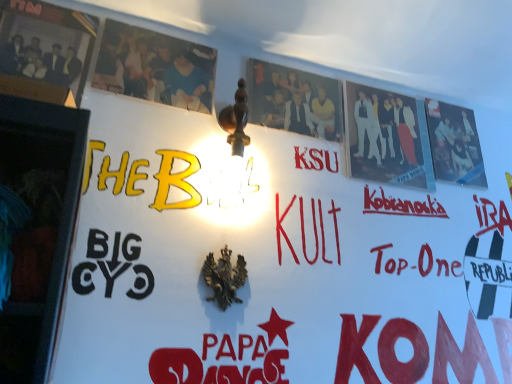
The width and height of the screenshot is (512, 384). In order to click on matte paper poster at center, which ranks as the third poster in right-to-left order in this screenshot , I will do `click(294, 100)`.

What do you see at coordinates (294, 100) in the screenshot? I see `matte paper poster at center, which ranks as the third poster in right-to-left order` at bounding box center [294, 100].

Measure the distance between matte paper poster at upper left, the fourth poster viewed from the right, and camera.

The distance of matte paper poster at upper left, the fourth poster viewed from the right, from camera is 3.76 feet.

What do you see at coordinates (454, 144) in the screenshot? I see `matte black poster at upper right, which ranks as the fifth poster in left-to-right order` at bounding box center [454, 144].

The image size is (512, 384). I want to click on silhouette paper poster at upper right, the 4th poster viewed from the left, so click(387, 138).

The image size is (512, 384). What do you see at coordinates (387, 138) in the screenshot?
I see `silhouette paper poster at upper right, which appears as the 2th poster when viewed from the right` at bounding box center [387, 138].

Where is `matte paper poster at center, which ranks as the third poster in right-to-left order`? matte paper poster at center, which ranks as the third poster in right-to-left order is located at coordinates (294, 100).

Is matte black poster at upper right, positioned as the first poster in right-to-left order, facing away from matte black photo frame at upper left, which ranks as the fifth poster in right-to-left order?

No, matte black poster at upper right, positioned as the first poster in right-to-left order,'s orientation is not away from matte black photo frame at upper left, which ranks as the fifth poster in right-to-left order.

Can you tell me how much matte black poster at upper right, positioned as the first poster in right-to-left order, and matte black photo frame at upper left, which ranks as the fifth poster in right-to-left order, differ in facing direction?

matte black poster at upper right, positioned as the first poster in right-to-left order, and matte black photo frame at upper left, which ranks as the fifth poster in right-to-left order, are facing 0.000287 degrees away from each other.

Considering the positions of objects matte black poster at upper right, which ranks as the fifth poster in left-to-right order, and matte black photo frame at upper left, which ranks as the fifth poster in right-to-left order, in the image provided, who is behind, matte black poster at upper right, which ranks as the fifth poster in left-to-right order, or matte black photo frame at upper left, which ranks as the fifth poster in right-to-left order,?

matte black poster at upper right, which ranks as the fifth poster in left-to-right order.

From a real-world perspective, is matte black poster at upper right, positioned as the first poster in right-to-left order, physically above matte black photo frame at upper left, which is counted as the 1th poster, starting from the left?

Yes, from a real-world perspective, matte black poster at upper right, positioned as the first poster in right-to-left order, is on top of matte black photo frame at upper left, which is counted as the 1th poster, starting from the left.

Where is `the 1st poster below the matte paper poster at upper left, the fourth poster viewed from the right (from the image's perspective)`? The height and width of the screenshot is (384, 512). the 1st poster below the matte paper poster at upper left, the fourth poster viewed from the right (from the image's perspective) is located at coordinates (45, 51).

Consider the image. Which object is closer to the camera taking this photo, matte black photo frame at upper left, which is counted as the 1th poster, starting from the left, or matte paper poster at upper left, the fourth poster viewed from the right?

matte black photo frame at upper left, which is counted as the 1th poster, starting from the left, is in front.

Is matte paper poster at upper left, which is counted as the second poster, starting from the left, a part of matte black photo frame at upper left, which is counted as the 1th poster, starting from the left?

No, matte black photo frame at upper left, which is counted as the 1th poster, starting from the left, does not contain matte paper poster at upper left, which is counted as the second poster, starting from the left.

Considering the sizes of matte black photo frame at upper left, which ranks as the fifth poster in right-to-left order, and matte paper poster at upper left, the fourth poster viewed from the right, in the image, is matte black photo frame at upper left, which ranks as the fifth poster in right-to-left order, wider or thinner than matte paper poster at upper left, the fourth poster viewed from the right,?

Clearly, matte black photo frame at upper left, which ranks as the fifth poster in right-to-left order, has more width compared to matte paper poster at upper left, the fourth poster viewed from the right.

Consider the image. How different are the orientations of matte paper poster at center, which ranks as the third poster in left-to-right order, and silhouette paper poster at upper right, which appears as the 2th poster when viewed from the right, in degrees?

There is a 0.000237-degree angle between the facing directions of matte paper poster at center, which ranks as the third poster in left-to-right order, and silhouette paper poster at upper right, which appears as the 2th poster when viewed from the right.

Is matte paper poster at center, which ranks as the third poster in right-to-left order, touching silhouette paper poster at upper right, which appears as the 2th poster when viewed from the right?

No, matte paper poster at center, which ranks as the third poster in right-to-left order, is not beside silhouette paper poster at upper right, which appears as the 2th poster when viewed from the right.

Considering the sizes of matte paper poster at center, which ranks as the third poster in left-to-right order, and silhouette paper poster at upper right, which appears as the 2th poster when viewed from the right, in the image, is matte paper poster at center, which ranks as the third poster in left-to-right order, bigger or smaller than silhouette paper poster at upper right, which appears as the 2th poster when viewed from the right,?

Clearly, matte paper poster at center, which ranks as the third poster in left-to-right order, is smaller in size than silhouette paper poster at upper right, which appears as the 2th poster when viewed from the right.

From the image's perspective, which is below, matte black photo frame at upper left, which is counted as the 1th poster, starting from the left, or silhouette paper poster at upper right, the 4th poster viewed from the left?

From the image's view, silhouette paper poster at upper right, the 4th poster viewed from the left, is below.

Is matte black photo frame at upper left, which ranks as the fifth poster in right-to-left order, not near silhouette paper poster at upper right, the 4th poster viewed from the left?

They are positioned close to each other.

In order to click on the 3rd poster counting from the right of the matte black photo frame at upper left, which is counted as the 1th poster, starting from the left in this screenshot , I will do `click(387, 138)`.

Is point (26, 88) behind point (391, 106)?

No.

Between silhouette paper poster at upper right, which appears as the 2th poster when viewed from the right, and matte paper poster at upper left, the fourth poster viewed from the right, which one has smaller width?

Thinner between the two is matte paper poster at upper left, the fourth poster viewed from the right.

Where is `the 3rd poster positioned below the matte paper poster at upper left, which is counted as the second poster, starting from the left (from a real-world perspective)`? the 3rd poster positioned below the matte paper poster at upper left, which is counted as the second poster, starting from the left (from a real-world perspective) is located at coordinates (387, 138).

Does silhouette paper poster at upper right, which appears as the 2th poster when viewed from the right, turn towards matte paper poster at upper left, which is counted as the second poster, starting from the left?

No, silhouette paper poster at upper right, which appears as the 2th poster when viewed from the right, does not turn towards matte paper poster at upper left, which is counted as the second poster, starting from the left.

From a real-world perspective, is silhouette paper poster at upper right, which appears as the 2th poster when viewed from the right, physically above matte paper poster at upper left, the fourth poster viewed from the right?

Actually, silhouette paper poster at upper right, which appears as the 2th poster when viewed from the right, is physically below matte paper poster at upper left, the fourth poster viewed from the right, in the real world.

Is silhouette paper poster at upper right, which appears as the 2th poster when viewed from the right, next to matte paper poster at center, which ranks as the third poster in right-to-left order?

No, silhouette paper poster at upper right, which appears as the 2th poster when viewed from the right, is not in contact with matte paper poster at center, which ranks as the third poster in right-to-left order.

Which point is more forward, (360, 140) or (254, 118)?

The point (254, 118) is more forward.

Based on the photo, which is more to the right, silhouette paper poster at upper right, which appears as the 2th poster when viewed from the right, or matte paper poster at center, which ranks as the third poster in right-to-left order?

From the viewer's perspective, silhouette paper poster at upper right, which appears as the 2th poster when viewed from the right, appears more on the right side.

Could silhouette paper poster at upper right, the 4th poster viewed from the left, be considered to be inside matte paper poster at upper left, which is counted as the second poster, starting from the left?

Definitely not — silhouette paper poster at upper right, the 4th poster viewed from the left, is not inside matte paper poster at upper left, which is counted as the second poster, starting from the left.

From a real-world perspective, who is located higher, matte paper poster at upper left, the fourth poster viewed from the right, or silhouette paper poster at upper right, which appears as the 2th poster when viewed from the right?

matte paper poster at upper left, the fourth poster viewed from the right, from a real-world perspective.

From the picture: Is matte paper poster at upper left, the fourth poster viewed from the right, not near silhouette paper poster at upper right, which appears as the 2th poster when viewed from the right?

No, matte paper poster at upper left, the fourth poster viewed from the right, is in close proximity to silhouette paper poster at upper right, which appears as the 2th poster when viewed from the right.

Where is `the 1st poster above the matte black photo frame at upper left, which ranks as the fifth poster in right-to-left order (from a real-world perspective)`? the 1st poster above the matte black photo frame at upper left, which ranks as the fifth poster in right-to-left order (from a real-world perspective) is located at coordinates (454, 144).

Locate an element on the screen. poster above the matte black photo frame at upper left, which is counted as the 1th poster, starting from the left (from the image's perspective) is located at coordinates (155, 67).

Estimate the real-world distances between objects in this image. Which object is further from matte paper poster at upper left, the fourth poster viewed from the right, matte paper poster at center, which ranks as the third poster in left-to-right order, or matte black poster at upper right, which ranks as the fifth poster in left-to-right order?

The object further to matte paper poster at upper left, the fourth poster viewed from the right, is matte black poster at upper right, which ranks as the fifth poster in left-to-right order.

Estimate the real-world distances between objects in this image. Which object is closer to silhouette paper poster at upper right, which appears as the 2th poster when viewed from the right, matte black poster at upper right, which ranks as the fifth poster in left-to-right order, or matte black photo frame at upper left, which is counted as the 1th poster, starting from the left?

matte black poster at upper right, which ranks as the fifth poster in left-to-right order, is closer to silhouette paper poster at upper right, which appears as the 2th poster when viewed from the right.

Estimate the real-world distances between objects in this image. Which object is closer to matte black poster at upper right, positioned as the first poster in right-to-left order, matte paper poster at center, which ranks as the third poster in right-to-left order, or matte paper poster at upper left, which is counted as the second poster, starting from the left?

Based on the image, matte paper poster at center, which ranks as the third poster in right-to-left order, appears to be nearer to matte black poster at upper right, positioned as the first poster in right-to-left order.

Which object lies nearer to the anchor point matte paper poster at center, which ranks as the third poster in left-to-right order, silhouette paper poster at upper right, the 4th poster viewed from the left, or matte black poster at upper right, which ranks as the fifth poster in left-to-right order?

silhouette paper poster at upper right, the 4th poster viewed from the left.

Estimate the real-world distances between objects in this image. Which object is closer to silhouette paper poster at upper right, the 4th poster viewed from the left, matte paper poster at center, which ranks as the third poster in right-to-left order, or matte black photo frame at upper left, which ranks as the fifth poster in right-to-left order?

matte paper poster at center, which ranks as the third poster in right-to-left order, lies closer to silhouette paper poster at upper right, the 4th poster viewed from the left, than the other object.

Estimate the real-world distances between objects in this image. Which object is further from matte paper poster at upper left, which is counted as the second poster, starting from the left, silhouette paper poster at upper right, the 4th poster viewed from the left, or matte paper poster at center, which ranks as the third poster in right-to-left order?

silhouette paper poster at upper right, the 4th poster viewed from the left, is positioned further to the anchor matte paper poster at upper left, which is counted as the second poster, starting from the left.

Consider the image. Estimate the real-world distances between objects in this image. Which object is closer to matte paper poster at upper left, which is counted as the second poster, starting from the left, matte black photo frame at upper left, which ranks as the fifth poster in right-to-left order, or matte paper poster at center, which ranks as the third poster in left-to-right order?

matte black photo frame at upper left, which ranks as the fifth poster in right-to-left order, is closer to matte paper poster at upper left, which is counted as the second poster, starting from the left.

Based on their spatial positions, is matte paper poster at upper left, the fourth poster viewed from the right, or silhouette paper poster at upper right, the 4th poster viewed from the left, further from matte black photo frame at upper left, which ranks as the fifth poster in right-to-left order?

Based on the image, silhouette paper poster at upper right, the 4th poster viewed from the left, appears to be further to matte black photo frame at upper left, which ranks as the fifth poster in right-to-left order.

I want to click on poster situated between matte paper poster at upper left, which is counted as the second poster, starting from the left, and silhouette paper poster at upper right, the 4th poster viewed from the left, from left to right, so click(x=294, y=100).

What are the coordinates of `poster between matte black photo frame at upper left, which is counted as the 1th poster, starting from the left, and matte paper poster at center, which ranks as the third poster in right-to-left order, from left to right` in the screenshot? It's located at (155, 67).

Find the location of a particular element. The width and height of the screenshot is (512, 384). poster located between matte paper poster at center, which ranks as the third poster in right-to-left order, and matte black poster at upper right, positioned as the first poster in right-to-left order, in the left-right direction is located at coordinates (387, 138).